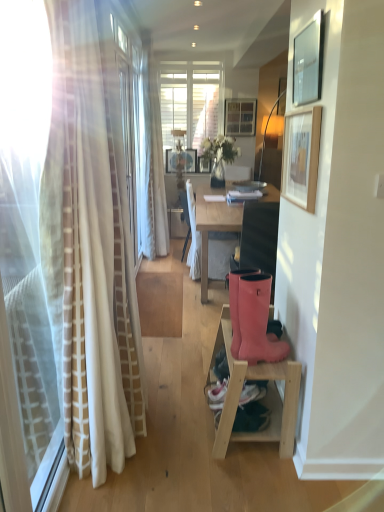
Question: Based on their sizes in the image, would you say wooden picture frame at center, positioned as the first picture frame in back-to-front order, is bigger or smaller than wooden picture frame at upper right, marked as the 3th picture frame in a right-to-left arrangement?

Choices:
 (A) small
 (B) big

Answer: (A)

Question: In terms of width, does wooden picture frame at center, which is the 1th picture frame in left-to-right order, look wider or thinner when compared to wooden picture frame at upper right, marked as the 3th picture frame in a right-to-left arrangement?

Choices:
 (A) thin
 (B) wide

Answer: (B)

Question: Considering the real-world distances, which object is farthest from the wooden picture frame at center, which is the fourth picture frame from front to back?

Choices:
 (A) light wood shelf at lower right
 (B) wooden picture frame at upper center, the first picture frame viewed from the top
 (C) matte black picture frame at upper right, the second picture frame from the bottom
 (D) wooden picture frame at upper right, which is the second picture frame in left-to-right order
 (E) pink rubber boots at lower right

Answer: (A)

Question: Which object is the farthest from the rubber boots at lower right?

Choices:
 (A) light wood shelf at lower right
 (B) wooden picture frame at upper center, which ranks as the second picture frame in back-to-front order
 (C) matte black picture frame at upper right, acting as the 3th picture frame starting from the left
 (D) pink rubber boots at lower right
 (E) wooden picture frame at center, the fourth picture frame in the right-to-left sequence

Answer: (B)